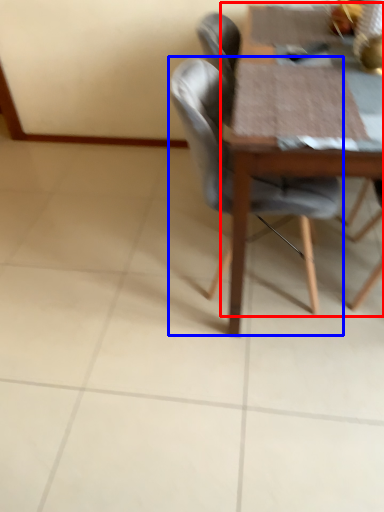
Question: Which object appears farthest to the camera in this image, round table (highlighted by a red box) or chair (highlighted by a blue box)?

Choices:
 (A) round table
 (B) chair

Answer: (B)